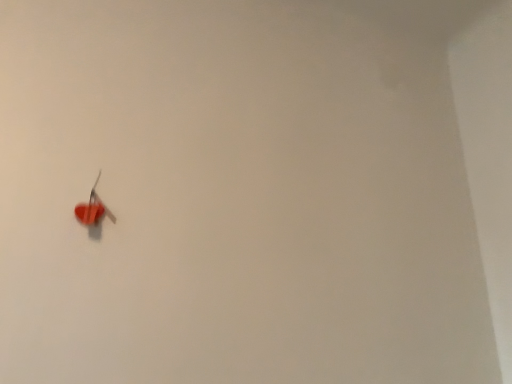
Measure the distance between matte plastic heart at lower left and camera.

A distance of 39.29 inches exists between matte plastic heart at lower left and camera.

Image resolution: width=512 pixels, height=384 pixels. What do you see at coordinates (93, 208) in the screenshot? I see `matte plastic heart at lower left` at bounding box center [93, 208].

Image resolution: width=512 pixels, height=384 pixels. In order to click on matte plastic heart at lower left in this screenshot , I will do `click(93, 208)`.

At what (x,y) coordinates should I click in order to perform the action: click on matte plastic heart at lower left. Please return your answer as a coordinate pair (x, y). Looking at the image, I should click on (93, 208).